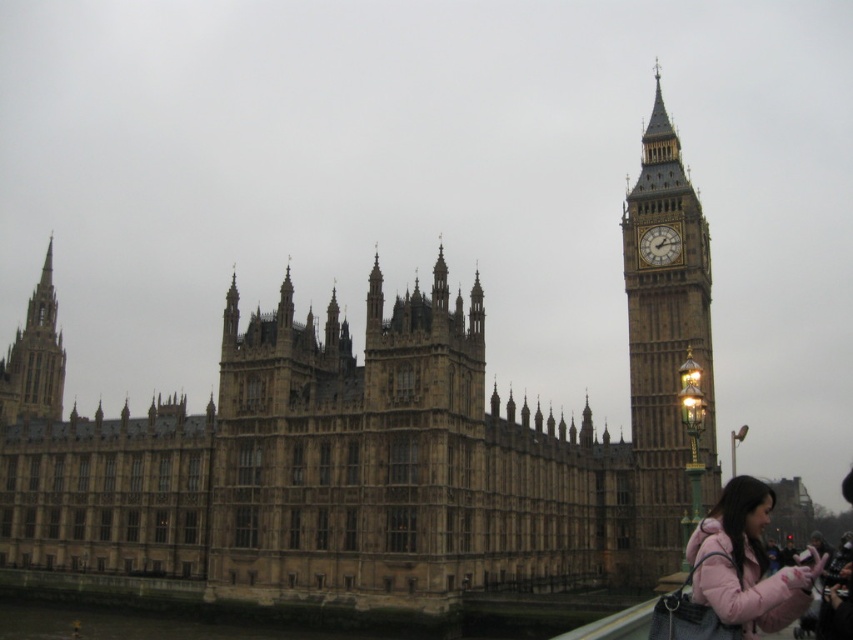
Is point (734, 589) positioned behind point (55, 372)?

No, (734, 589) is in front of (55, 372).

Is pink fleece jacket at lower right wider than brown stone spire at left?

Correct, the width of pink fleece jacket at lower right exceeds that of brown stone spire at left.

Is point (753, 561) positioned in front of point (18, 368)?

That is True.

You are a GUI agent. You are given a task and a screenshot of the screen. Output one action in this format:
    pyautogui.click(x=<x>, y=<y>)
    Task: Click on the pink fleece jacket at lower right
    
    Given the screenshot: What is the action you would take?
    pyautogui.click(x=746, y=563)

Can you confirm if brown stone clock tower at right is wider than brown stone spire at left?

Indeed, brown stone clock tower at right has a greater width compared to brown stone spire at left.

This screenshot has height=640, width=853. What do you see at coordinates (666, 353) in the screenshot? I see `brown stone clock tower at right` at bounding box center [666, 353].

This screenshot has height=640, width=853. Find the location of `brown stone clock tower at right`. brown stone clock tower at right is located at coordinates point(666,353).

Is pink fleece jacket at lower right shorter than golden stone clock at upper right?

In fact, pink fleece jacket at lower right may be taller than golden stone clock at upper right.

Is point (807, 598) closer to camera compared to point (668, 244)?

Yes, it is in front of point (668, 244).

This screenshot has height=640, width=853. What do you see at coordinates (746, 563) in the screenshot?
I see `pink fleece jacket at lower right` at bounding box center [746, 563].

The height and width of the screenshot is (640, 853). I want to click on pink fleece jacket at lower right, so click(x=746, y=563).